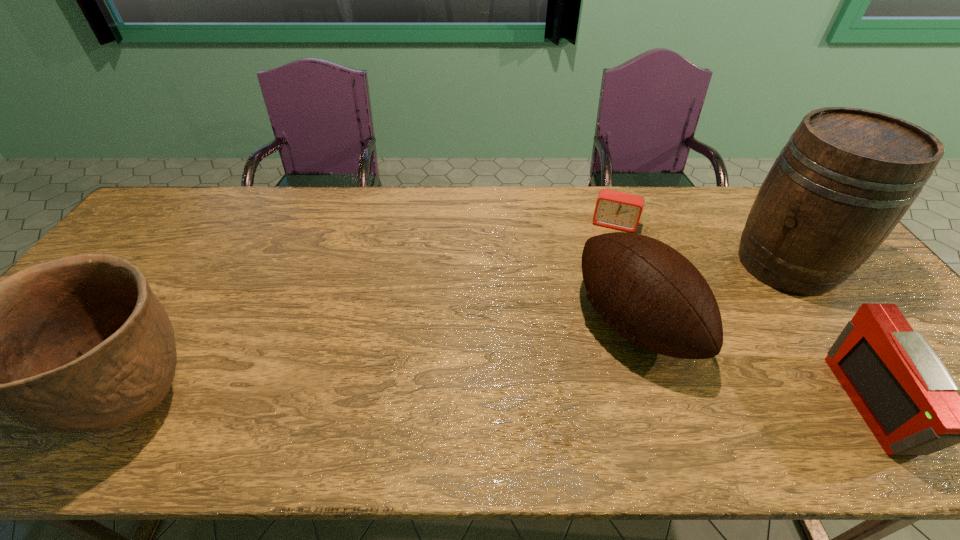
The height and width of the screenshot is (540, 960). What are the coordinates of `free space between the cider and the fourth tallest object` in the screenshot? It's located at (830, 334).

Locate an element on the screen. The image size is (960, 540). vacant region between the tallest object and the second tallest object is located at coordinates (464, 334).

Select which object appears as the closest to the leftmost object. Please provide its 2D coordinates. Your answer should be formatted as a tuple, i.e. [(x, y)], where the tuple contains the x and y coordinates of a point satisfying the conditions above.

[(647, 291)]

You are a GUI agent. You are given a task and a screenshot of the screen. Output one action in this format:
    pyautogui.click(x=<x>, y=<y>)
    Task: Click on the object that is the second closest to the tallest object
    The image size is (960, 540).
    Given the screenshot: What is the action you would take?
    pyautogui.click(x=647, y=291)

Image resolution: width=960 pixels, height=540 pixels. What are the coordinates of `free spot that satisfies the following two spatial constraints: 1. on the front side of the alarm clock; 2. on the front-facing side of the fourth tallest object` in the screenshot? It's located at (676, 404).

Locate an element on the screen. The width and height of the screenshot is (960, 540). vacant space that satisfies the following two spatial constraints: 1. on the back side of the pottery; 2. on the right side of the alarm clock is located at coordinates (249, 225).